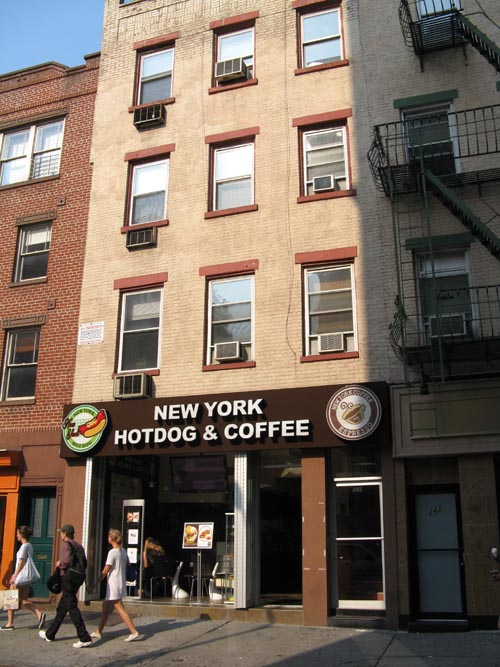
The height and width of the screenshot is (667, 500). In order to click on 2nd floor window in this screenshot , I will do `click(30, 371)`, `click(136, 331)`, `click(230, 325)`, `click(324, 327)`, `click(454, 299)`.